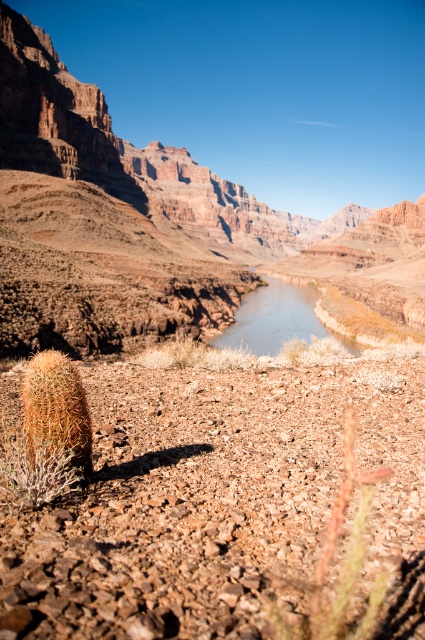
You are a hiker who wants to take a photo of the brown rocky canyon at center and the orange spiny cactus at lower left. Which object should you focus on first if you want to capture both in a single frame without moving your camera?

The orange spiny cactus at lower left should be focused on first because the brown rocky canyon at center is above it, so adjusting focus to the cactus ensures both are within the camera frame.

You are planning to cross the clear water at center in the desert scene. There is a brown fuzzy cactus at lower center nearby. Which object is larger in size?

The clear water at center is larger than the brown fuzzy cactus at lower center.

You are navigating a drone through the desert scene shown in the image. Your drone is currently at point A, which is at coordinates point (95, 138). You need to fly it to point B at coordinates point (325, 545). Considering the desert terrain, which direction should you fly the drone to move from point A to point B?

To move from point (95, 138) to point (325, 545), you should fly the drone towards the upper right direction since point (325, 545) is located at a higher coordinate in both x and y axes compared to point (95, 138).